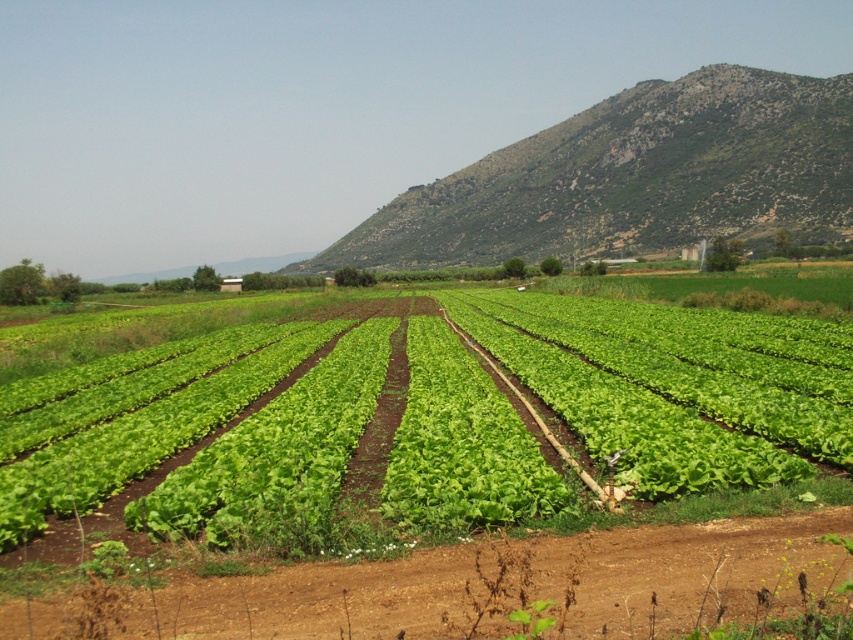
Question: Can you confirm if green leafy vegetable at center is positioned to the left of green grassy hillside at upper right?

Choices:
 (A) yes
 (B) no

Answer: (A)

Question: Which point is closer to the camera?

Choices:
 (A) green grassy hillside at upper right
 (B) green leafy vegetable at center

Answer: (B)

Question: Is green leafy vegetable at center thinner than green grassy hillside at upper right?

Choices:
 (A) no
 (B) yes

Answer: (B)

Question: Is green leafy vegetable at center positioned in front of green grassy hillside at upper right?

Choices:
 (A) yes
 (B) no

Answer: (A)